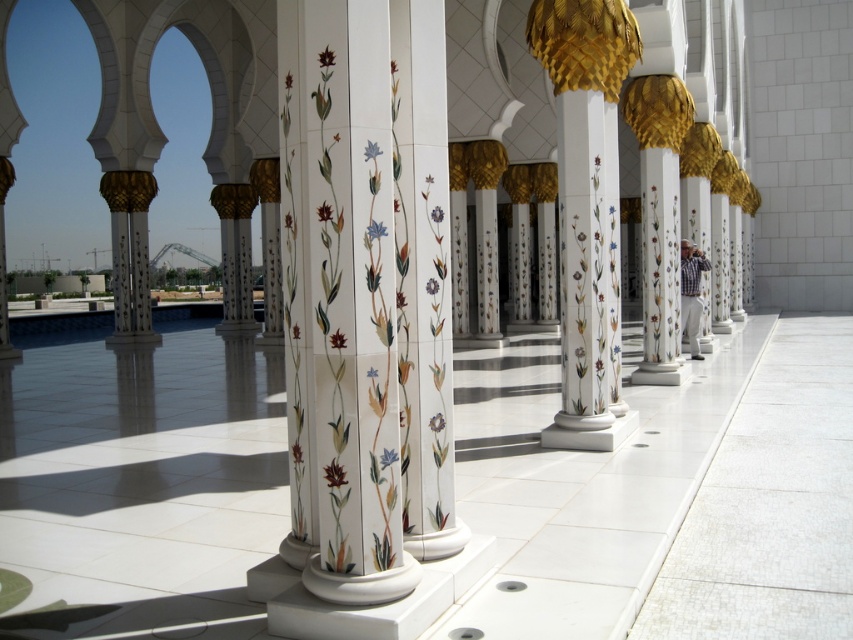
Question: Which point is closer to the camera?

Choices:
 (A) (560, 176)
 (B) (380, 208)

Answer: (B)

Question: Which of the following is the closest to the observer?

Choices:
 (A) (323, 4)
 (B) (578, 243)

Answer: (A)

Question: Is porcelain floral columns at center below white marble column at center?

Choices:
 (A) yes
 (B) no

Answer: (A)

Question: Is porcelain floral columns at center further to the viewer compared to white marble column at center?

Choices:
 (A) no
 (B) yes

Answer: (A)

Question: Can you confirm if porcelain floral columns at center is positioned to the right of white marble column at center?

Choices:
 (A) yes
 (B) no

Answer: (B)